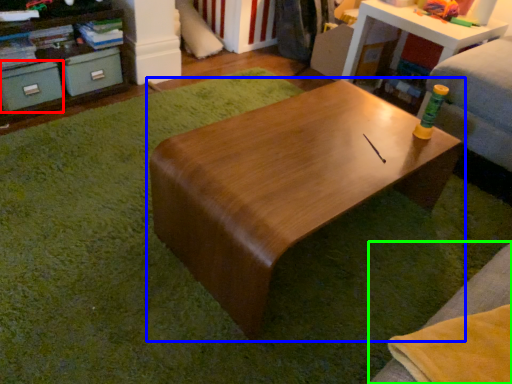
Question: Which is nearer to the drawer (highlighted by a red box)? table (highlighted by a blue box) or couch (highlighted by a green box).

Choices:
 (A) table
 (B) couch

Answer: (A)